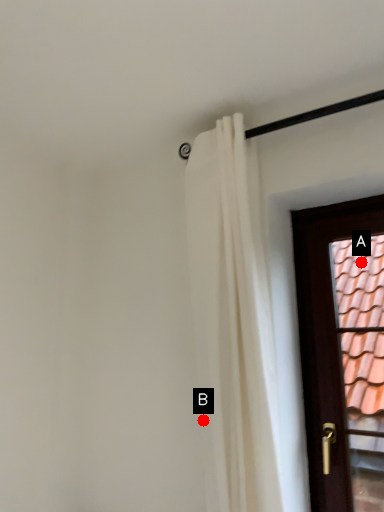
Question: Two points are circled on the image, labeled by A and B beside each circle. Which of the following is the closest to the observer?

Choices:
 (A) A is closer
 (B) B is closer

Answer: (B)